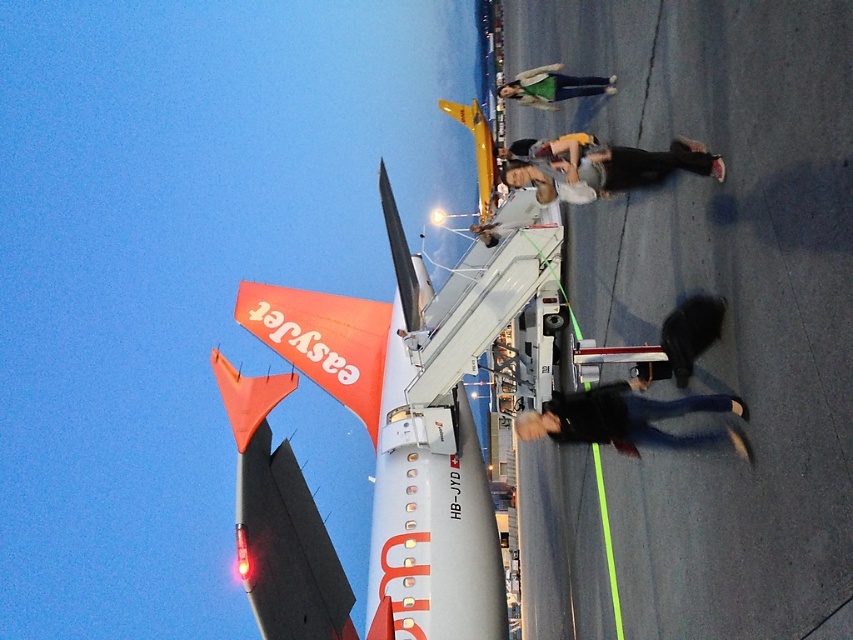
Question: In this image, where is orange matte airplane tail at upper left located relative to matte gray jacket at center?

Choices:
 (A) above
 (B) below

Answer: (B)

Question: Which is farther from the orange matte airplane tail at upper left?

Choices:
 (A) black matte jacket at lower right
 (B) matte gray jacket at upper center

Answer: (B)

Question: Is orange matte airplane tail at upper left to the left of black matte jacket at lower right from the viewer's perspective?

Choices:
 (A) yes
 (B) no

Answer: (A)

Question: Which object appears farthest from the camera in this image?

Choices:
 (A) black matte jacket at lower right
 (B) matte gray jacket at center
 (C) matte gray jacket at upper center
 (D) orange matte airplane tail at upper left

Answer: (D)

Question: Considering the relative positions of orange matte airplane tail at upper left and black matte jacket at lower right in the image provided, where is orange matte airplane tail at upper left located with respect to black matte jacket at lower right?

Choices:
 (A) below
 (B) above

Answer: (B)

Question: Among these objects, which one is nearest to the camera?

Choices:
 (A) matte gray jacket at center
 (B) orange matte airplane tail at upper left
 (C) black matte jacket at lower right
 (D) matte gray jacket at upper center

Answer: (C)